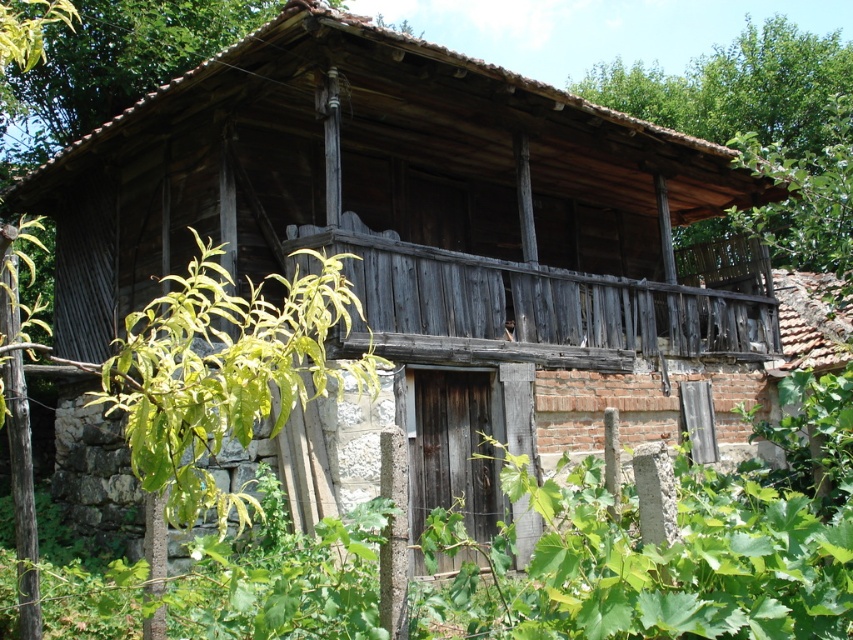
Question: Among these objects, which one is farthest from the camera?

Choices:
 (A) green leafy plant at center
 (B) green leafy tree at upper right

Answer: (B)

Question: Can you confirm if green leafy plant at center is positioned below green leafy tree at upper right?

Choices:
 (A) no
 (B) yes

Answer: (B)

Question: Which of the following is the farthest from the observer?

Choices:
 (A) green leafy plant at center
 (B) green leafy tree at upper right

Answer: (B)

Question: Does green leafy plant at center come in front of green leafy tree at upper right?

Choices:
 (A) yes
 (B) no

Answer: (A)

Question: Is the position of green leafy plant at center less distant than that of green leafy tree at upper right?

Choices:
 (A) no
 (B) yes

Answer: (B)

Question: Among these objects, which one is farthest from the camera?

Choices:
 (A) green leafy plant at center
 (B) green leafy tree at upper right

Answer: (B)